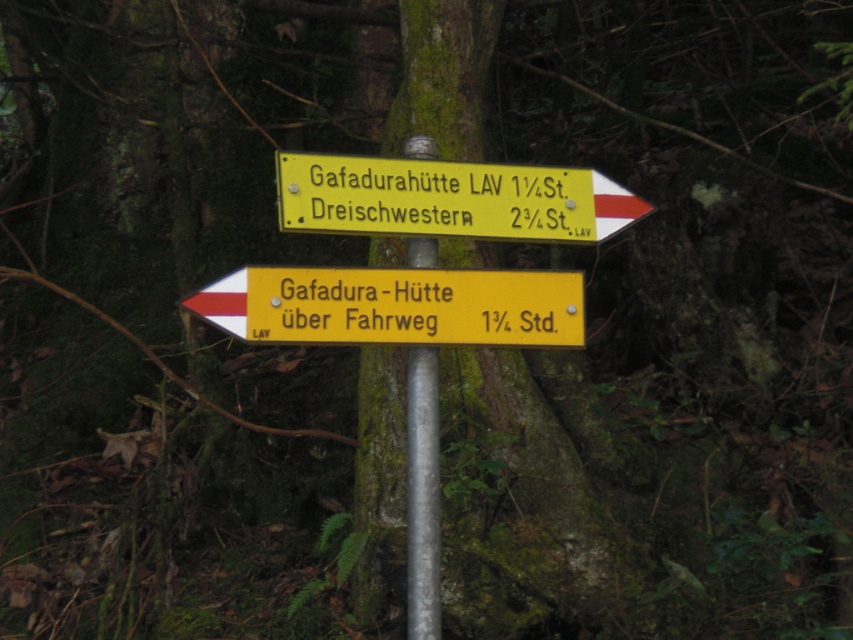
Between point (207, 321) and point (454, 184), which one is positioned behind?

The point (454, 184) is more distant.

Where is `yellow plastic sign at center`? The width and height of the screenshot is (853, 640). yellow plastic sign at center is located at coordinates (395, 307).